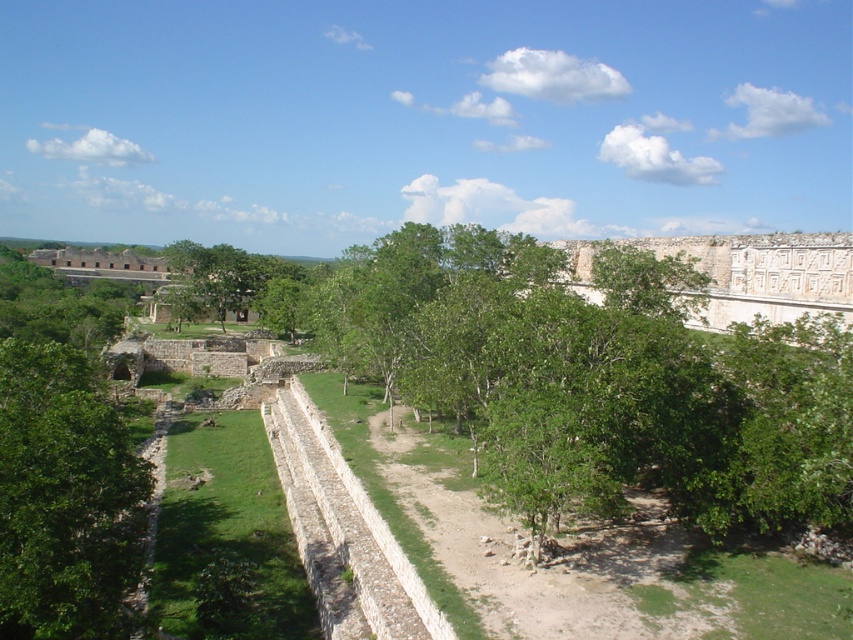
From the picture: Does white stone wall at upper right have a greater height compared to green leafy tree at center?

No.

Is point (820, 284) less distant than point (196, 314)?

Yes, point (820, 284) is in front of point (196, 314).

Where is `white stone wall at upper right`? The width and height of the screenshot is (853, 640). white stone wall at upper right is located at coordinates (763, 275).

Who is higher up, green leafy tree at left or white stone wall at upper right?

white stone wall at upper right is higher up.

Does green leafy tree at left have a lesser height compared to white stone wall at upper right?

Indeed, green leafy tree at left has a lesser height compared to white stone wall at upper right.

The width and height of the screenshot is (853, 640). I want to click on green leafy tree at left, so click(x=62, y=497).

Does green leafy tree at left appear on the left side of green leafy tree at center?

Incorrect, green leafy tree at left is not on the left side of green leafy tree at center.

Is green leafy tree at left wider than green leafy tree at center?

No, green leafy tree at left is not wider than green leafy tree at center.

Identify the location of green leafy tree at left. (62, 497).